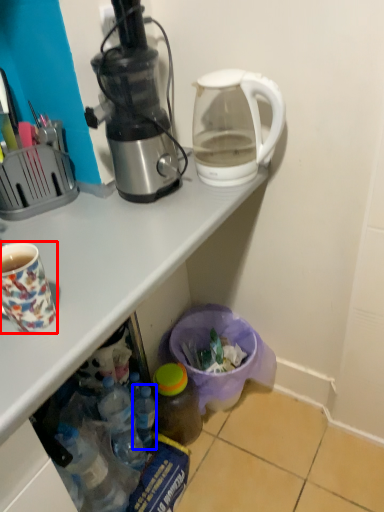
Question: Which object appears closest to the camera in this image, coffee cup (highlighted by a red box) or bottle (highlighted by a blue box)?

Choices:
 (A) coffee cup
 (B) bottle

Answer: (A)